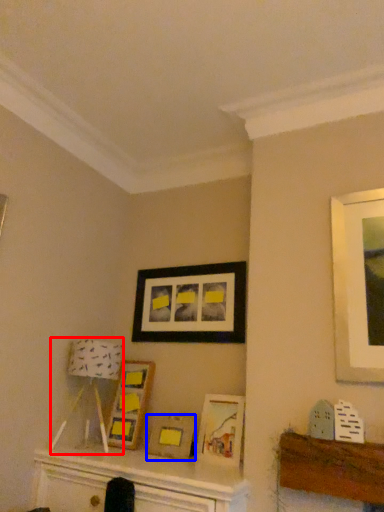
Question: Which of the following is the farthest to the observer, lamp (highlighted by a red box) or picture frame (highlighted by a blue box)?

Choices:
 (A) lamp
 (B) picture frame

Answer: (B)